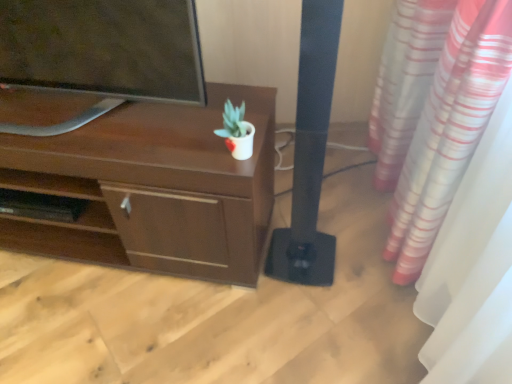
Where is `vacant space behind black matte speaker at center`? vacant space behind black matte speaker at center is located at coordinates (316, 208).